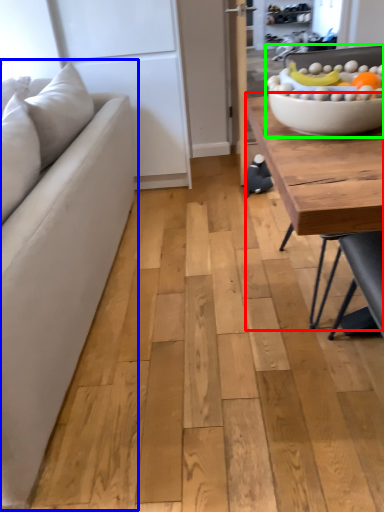
Question: Estimate the real-world distances between objects in this image. Which object is closer to coffee table (highlighted by a red box), studio couch (highlighted by a blue box) or bowl (highlighted by a green box)?

Choices:
 (A) studio couch
 (B) bowl

Answer: (B)